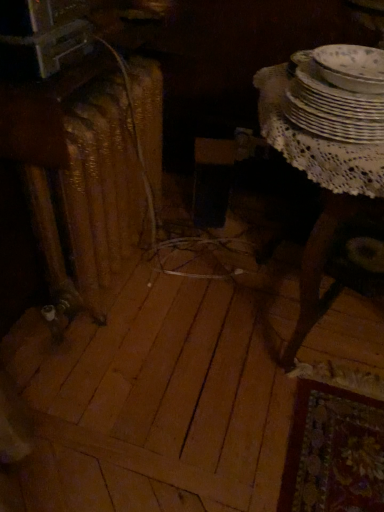
Identify the location of vacant area situated to the left side of white lace table at right. (156, 325).